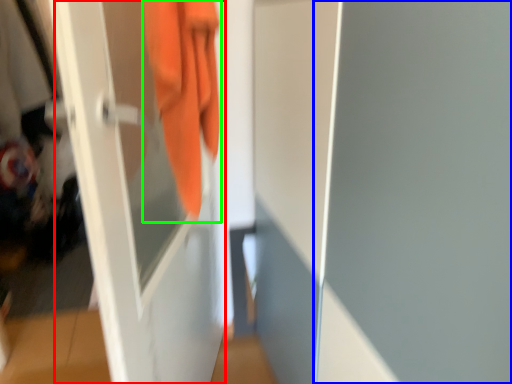
Question: Which is farther away from screen door (highlighted by a red box)? screen door (highlighted by a blue box) or towel (highlighted by a green box)?

Choices:
 (A) screen door
 (B) towel

Answer: (A)